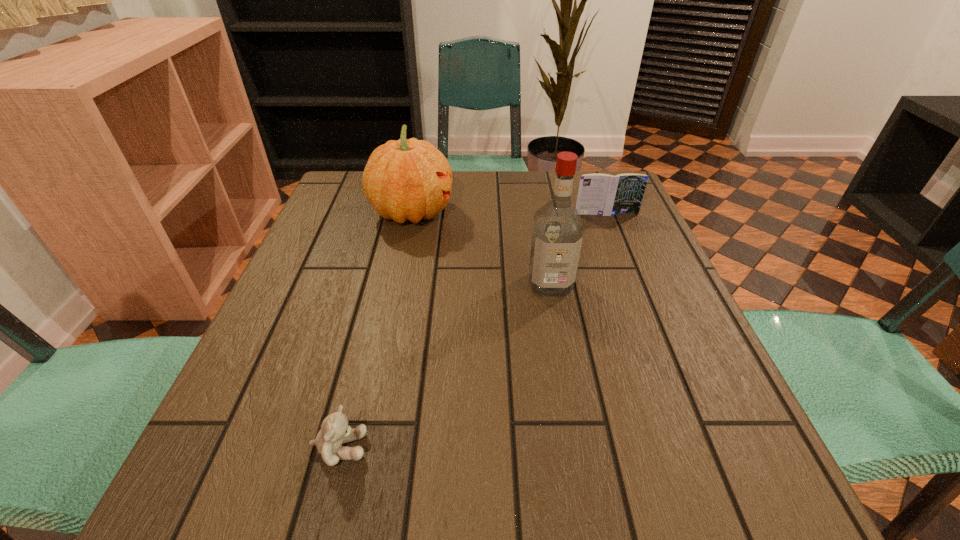
Find the location of a particular element. The width and height of the screenshot is (960, 540). free location at the left edge is located at coordinates (267, 408).

This screenshot has width=960, height=540. In the image, there is a desktop. Identify the location of free region at the right edge. (663, 426).

Locate an element on the screen. The image size is (960, 540). vacant space at the far left corner of the desktop is located at coordinates (363, 207).

Identify the location of empty space that is in between the second nearest object and the pumpkin. (481, 248).

Find the location of a particular element. vacant space in between the second object from right to left and the teddy bear is located at coordinates (445, 366).

Identify the location of vacant space that is in between the shortest object and the rightmost object. (473, 330).

Identify the location of empty space between the second tallest object and the rightmost object. (509, 213).

I want to click on vacant space that's between the teddy bear and the pumpkin, so click(376, 330).

This screenshot has height=540, width=960. I want to click on free space that is in between the book and the pumpkin, so click(509, 213).

You are a GUI agent. You are given a task and a screenshot of the screen. Output one action in this format:
    pyautogui.click(x=<x>, y=<y>)
    Task: Click on the free space between the third shortest object and the rightmost object
    
    Given the screenshot: What is the action you would take?
    pyautogui.click(x=509, y=213)